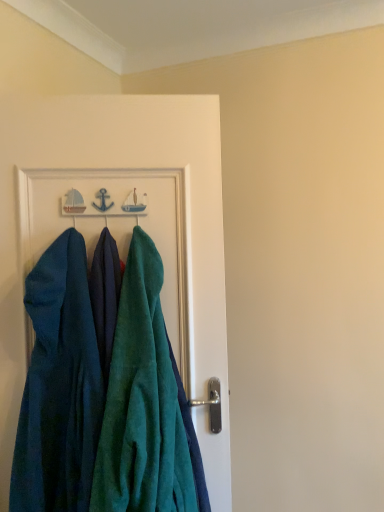
Measure the distance between teal velvety towel at center and camera.

3.66 feet.

Locate an element on the screen. This screenshot has height=512, width=384. teal towel at center is located at coordinates (121, 167).

This screenshot has width=384, height=512. What are the coordinates of `teal velvety towel at center` in the screenshot? It's located at (140, 390).

From the image's perspective, which is above, teal velvety dress at left or teal towel at center?

teal towel at center.

Could you tell me if teal velvety dress at left is facing teal towel at center?

No, teal velvety dress at left does not turn towards teal towel at center.

Can you see teal velvety dress at left touching teal towel at center?

teal velvety dress at left and teal towel at center are clearly separated.

From the image's perspective, is teal towel at center located above teal velvety towel at center?

Yes, from the image's perspective, teal towel at center is on top of teal velvety towel at center.

Is teal towel at center oriented towards teal velvety towel at center?

Yes, teal towel at center is facing teal velvety towel at center.

Does teal towel at center have a lesser width compared to teal velvety towel at center?

Yes, teal towel at center is thinner than teal velvety towel at center.

Which of these two, teal towel at center or teal velvety towel at center, stands shorter?

With less height is teal velvety towel at center.

Based on their positions, is teal towel at center located to the left or right of teal velvety dress at left?

teal towel at center is positioned on teal velvety dress at left's right side.

Is there a large distance between teal towel at center and teal velvety dress at left?

No, teal towel at center is in close proximity to teal velvety dress at left.

From a real-world perspective, is teal towel at center positioned over teal velvety dress at left based on gravity?

Indeed, from a real-world perspective, teal towel at center stands above teal velvety dress at left.

Is teal towel at center facing away from teal velvety dress at left?

Yes, teal towel at center is positioned with its back facing teal velvety dress at left.

Considering the positions of objects teal velvety towel at center and teal velvety dress at left in the image provided, who is in front, teal velvety towel at center or teal velvety dress at left?

Positioned in front is teal velvety towel at center.

Is teal velvety towel at center to the left of teal velvety dress at left from the viewer's perspective?

Incorrect, teal velvety towel at center is not on the left side of teal velvety dress at left.

How far apart are teal velvety towel at center and teal velvety dress at left?

teal velvety towel at center is 5.24 inches from teal velvety dress at left.

From a real-world perspective, which is physically above, teal velvety towel at center or teal velvety dress at left?

teal velvety dress at left is physically above.

Is teal velvety towel at center inside the boundaries of teal towel at center, or outside?

teal velvety towel at center cannot be found inside teal towel at center.

Looking at this image, would you consider teal velvety towel at center to be distant from teal towel at center?

No.

Is point (181, 419) positioned after point (5, 496)?

That is True.

Is teal velvety dress at left facing towards teal velvety towel at center?

No, teal velvety dress at left is not oriented towards teal velvety towel at center.

Which is behind, point (81, 276) or point (157, 508)?

The point (81, 276) is farther.

From the image's perspective, which one is positioned higher, teal velvety dress at left or teal velvety towel at center?

teal velvety towel at center is shown above in the image.

Which object is thinner, teal velvety dress at left or teal velvety towel at center?

With smaller width is teal velvety dress at left.

Identify the location of dress located in front of the teal towel at center. This screenshot has height=512, width=384. (59, 387).

You are a GUI agent. You are given a task and a screenshot of the screen. Output one action in this format:
    pyautogui.click(x=<x>, y=<y>)
    Task: Click on the door behind the teal velvety towel at center
    Image resolution: width=384 pixels, height=512 pixels.
    Given the screenshot: What is the action you would take?
    pyautogui.click(x=121, y=167)

When comparing their distances from teal velvety dress at left, does teal velvety towel at center or teal towel at center seem closer?

teal velvety towel at center is closer to teal velvety dress at left.

Based on their spatial positions, is teal towel at center or teal velvety dress at left further from teal velvety towel at center?

Based on the image, teal towel at center appears to be further to teal velvety towel at center.

Which object lies further to the anchor point teal velvety towel at center, teal velvety dress at left or teal towel at center?

The object further to teal velvety towel at center is teal towel at center.

From the image, which object appears to be nearer to teal velvety dress at left, teal towel at center or teal velvety towel at center?

teal velvety towel at center is positioned closer to the anchor teal velvety dress at left.

Considering their positions, is teal velvety dress at left positioned closer to teal towel at center than teal velvety towel at center?

The object closer to teal towel at center is teal velvety towel at center.

Estimate the real-world distances between objects in this image. Which object is further from teal towel at center, teal velvety towel at center or teal velvety dress at left?

Based on the image, teal velvety dress at left appears to be further to teal towel at center.

You are a GUI agent. You are given a task and a screenshot of the screen. Output one action in this format:
    pyautogui.click(x=<x>, y=<y>)
    Task: Click on the door between teal velvety dress at left and teal velvety towel at center in the horizontal direction
    The height and width of the screenshot is (512, 384).
    Given the screenshot: What is the action you would take?
    pyautogui.click(x=121, y=167)